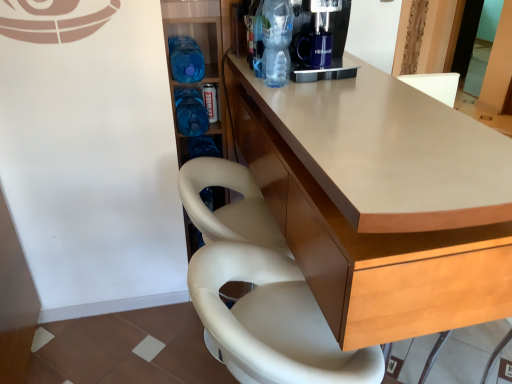
Image resolution: width=512 pixels, height=384 pixels. What are the coordinates of `free space in front of translucent plastic bottle at upper center, the third bottle in the left-to-right sequence` in the screenshot? It's located at (278, 91).